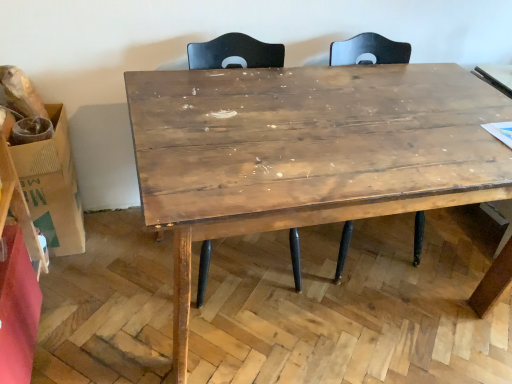
I want to click on vacant space that is to the left of matte wood swivel chair at center, so click(x=108, y=263).